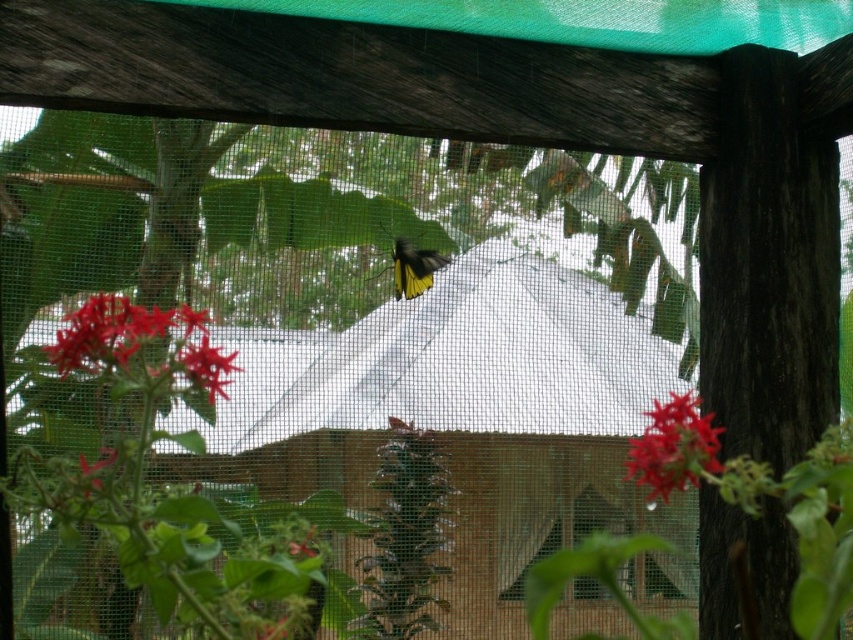
Is vivid red petals at lower left behind yellow matte butterfly at center?

No, it is not.

Who is positioned more to the left, vivid red petals at lower left or yellow matte butterfly at center?

vivid red petals at lower left is more to the left.

Between point (212, 392) and point (379, 273), which one is positioned behind?

Positioned behind is point (379, 273).

This screenshot has height=640, width=853. Identify the location of vivid red petals at lower left. (140, 346).

Does vivid red petals at lower left have a smaller size compared to smooth glossy red flower at center?

No, vivid red petals at lower left is not smaller than smooth glossy red flower at center.

Can you confirm if vivid red petals at lower left is wider than smooth glossy red flower at center?

Yes.

Does point (144, 332) come closer to viewer compared to point (694, 422)?

Yes, point (144, 332) is in front of point (694, 422).

Where is `vivid red petals at lower left`? This screenshot has width=853, height=640. vivid red petals at lower left is located at coordinates (140, 346).

Who is lower down, smooth glossy red flower at center or yellow matte butterfly at center?

smooth glossy red flower at center is below.

Can you confirm if smooth glossy red flower at center is shorter than yellow matte butterfly at center?

Indeed, smooth glossy red flower at center has a lesser height compared to yellow matte butterfly at center.

Does point (685, 465) come behind point (401, 266)?

That is False.

The image size is (853, 640). I want to click on smooth glossy red flower at center, so click(674, 448).